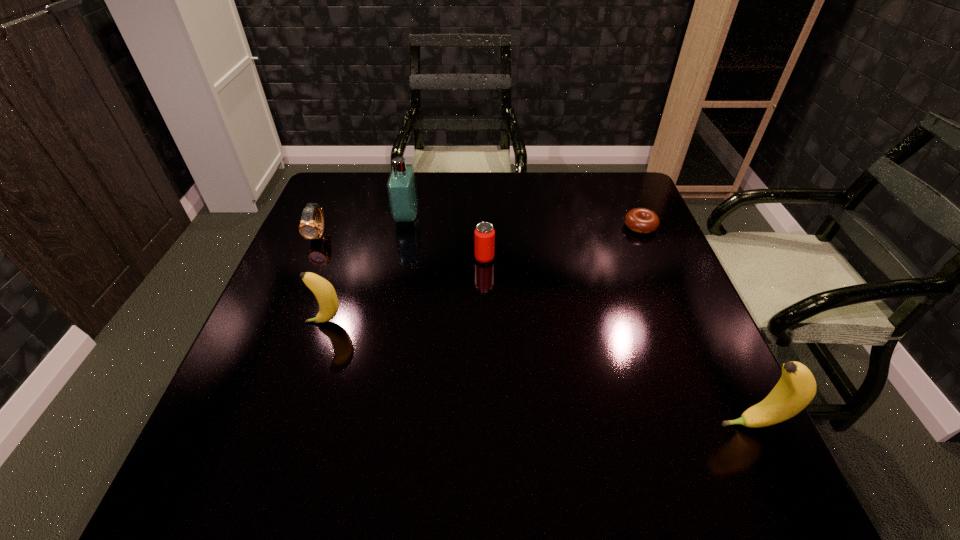
Find the location of a particular element. This screenshot has width=960, height=540. free space located from the stem of the left banana is located at coordinates (270, 322).

Locate an element on the screen. The width and height of the screenshot is (960, 540). vacant position located 0.280m from the stem of the right banana is located at coordinates (x=569, y=424).

Image resolution: width=960 pixels, height=540 pixels. I want to click on vacant space situated 0.230m from the stem of the right banana, so click(x=596, y=424).

This screenshot has width=960, height=540. What are the coordinates of `vacant area situated 0.200m from the stem of the right banana` in the screenshot? It's located at (612, 424).

Where is `vacant space situated on the front of the shortest object`? vacant space situated on the front of the shortest object is located at coordinates (660, 274).

Image resolution: width=960 pixels, height=540 pixels. Find the location of `vacant space situated 0.140m on the face of the watch`. vacant space situated 0.140m on the face of the watch is located at coordinates (299, 282).

The height and width of the screenshot is (540, 960). Identify the location of blank space located 0.050m on the front label of the perfume. (435, 218).

Locate an element on the screen. vacant space located on the back of the fourth object from left to right is located at coordinates (484, 184).

This screenshot has width=960, height=540. Identify the location of object that is at the far edge. (402, 192).

Identify the location of object that is at the near edge. (796, 388).